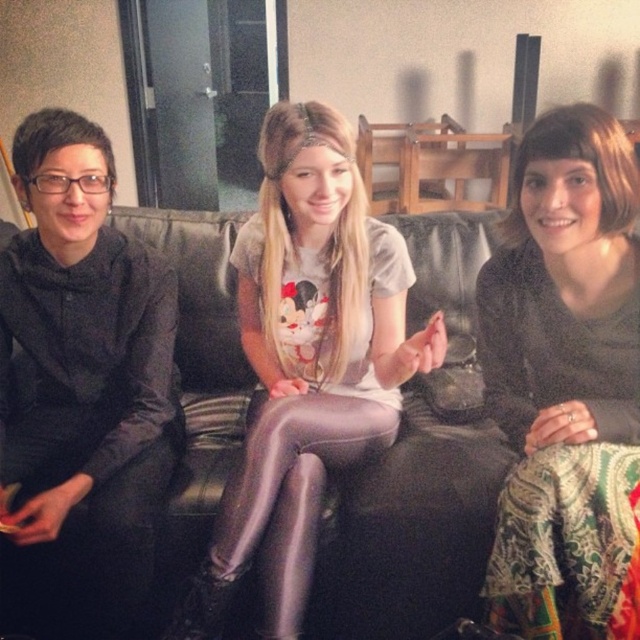
You are organizing a fashion show and need to determine which outfit piece is more suitable for a petite model. Based on the scene, which item between the black textured skirt at lower right and the matte purple leggings at center would you choose?

The black textured skirt at lower right has a smaller size compared to the matte purple leggings at center, making it more suitable for a petite model.